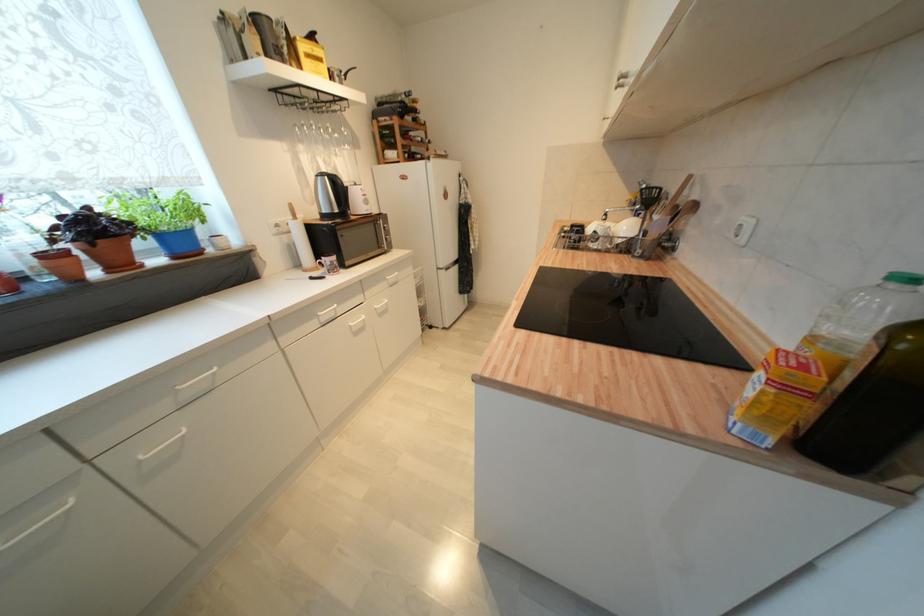
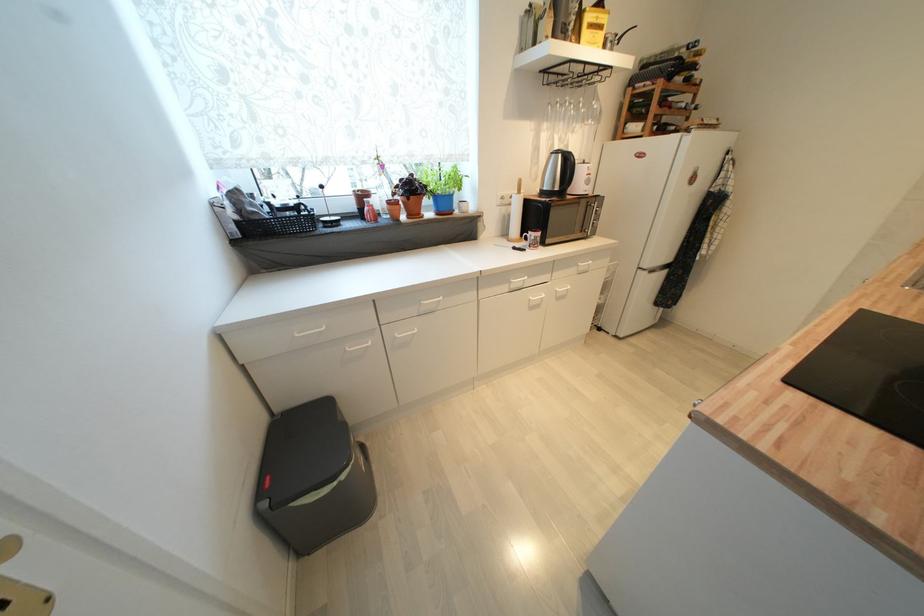
Find the pixel in the second image that matches [127,265] in the first image.

(419, 216)